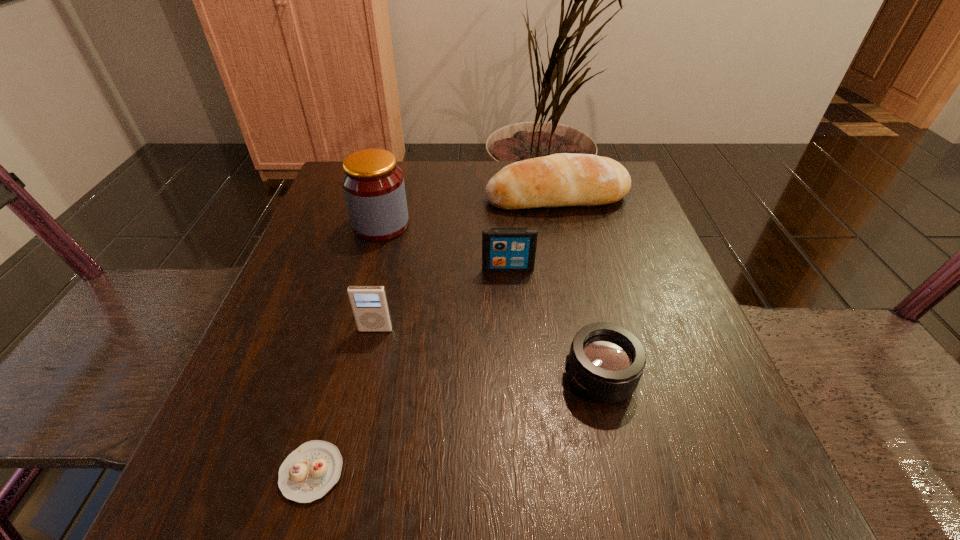
Identify the location of free spot between the left iPod and the nearest object. Image resolution: width=960 pixels, height=540 pixels. (344, 401).

At what (x,y) coordinates should I click in order to perform the action: click on free space that is in between the left iPod and the jar. Please return your answer as a coordinate pair (x, y). Image resolution: width=960 pixels, height=540 pixels. Looking at the image, I should click on (378, 277).

Locate an element on the screen. The width and height of the screenshot is (960, 540). free space between the tallest object and the nearer iPod is located at coordinates (378, 277).

I want to click on empty location between the bread and the nearest object, so click(434, 335).

Point out which object is positioned as the second nearest to the second shortest object. Please provide its 2D coordinates. Your answer should be formatted as a tuple, i.e. [(x, y)], where the tuple contains the x and y coordinates of a point satisfying the conditions above.

[(369, 304)]

Locate an element on the screen. Image resolution: width=960 pixels, height=540 pixels. object that is the second closest to the bread is located at coordinates (503, 249).